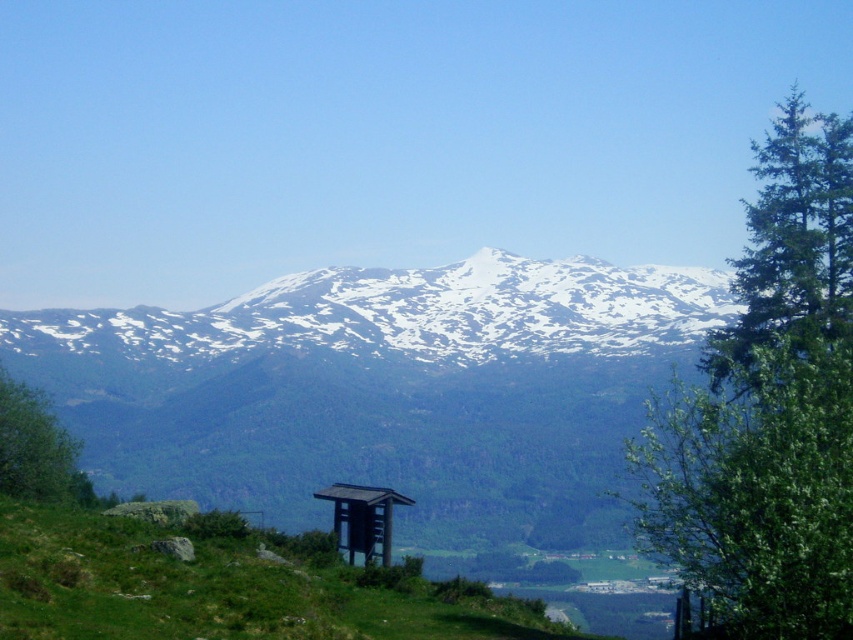
You are standing at the camera position and want to take a photo of the green leafy tree at right. If your camera has a maximum zoom range of 200 feet, will you be able to capture the tree clearly without moving closer?

The green leafy tree at right and camera are 201.75 feet apart from each other. Since the maximum zoom is 200 feet, the distance is slightly beyond the camera capability. Therefore, you cannot capture the tree clearly without moving closer.

You are standing at the base of the mountain and see the green grassy hillside at lower center and the brown wooden gazebo at center. Which object is closer to you?

The green grassy hillside at lower center is closer to you because it is positioned below the brown wooden gazebo at center, indicating it is lower in elevation and nearer in the scene.